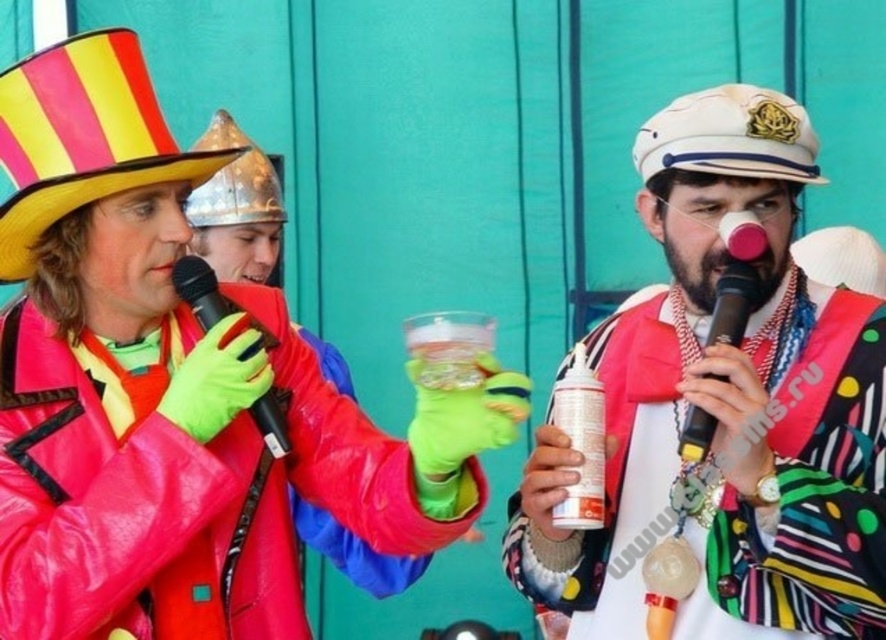
Between point (789, 493) and point (267, 337), which one is positioned behind?

The point (267, 337) is more distant.

Does polka dot fabric scarf at center appear on the right side of black plastic microphone at center?

Correct, you'll find polka dot fabric scarf at center to the right of black plastic microphone at center.

Find the location of a particular element. Image resolution: width=886 pixels, height=640 pixels. polka dot fabric scarf at center is located at coordinates (725, 476).

At what (x,y) coordinates should I click in order to perform the action: click on polka dot fabric scarf at center. Please return your answer as a coordinate pair (x, y). This screenshot has height=640, width=886. Looking at the image, I should click on (725, 476).

Who is more forward, (564, 381) or (216, 310)?

Point (216, 310) is more forward.

Is white matte can at center shorter than black plastic microphone at center?

Indeed, white matte can at center has a lesser height compared to black plastic microphone at center.

Which is in front, point (569, 500) or point (273, 342)?

Point (569, 500) is more forward.

Identify the location of white matte can at center. (581, 442).

Is polka dot fabric scarf at center above black matte microphone at center?

No, polka dot fabric scarf at center is not above black matte microphone at center.

Between polka dot fabric scarf at center and black matte microphone at center, which one appears on the right side from the viewer's perspective?

From the viewer's perspective, black matte microphone at center appears more on the right side.

You are a GUI agent. You are given a task and a screenshot of the screen. Output one action in this format:
    pyautogui.click(x=<x>, y=<y>)
    Task: Click on the polka dot fabric scarf at center
    The image size is (886, 640).
    Given the screenshot: What is the action you would take?
    pyautogui.click(x=725, y=476)

Image resolution: width=886 pixels, height=640 pixels. What are the coordinates of `polka dot fabric scarf at center` in the screenshot? It's located at (725, 476).